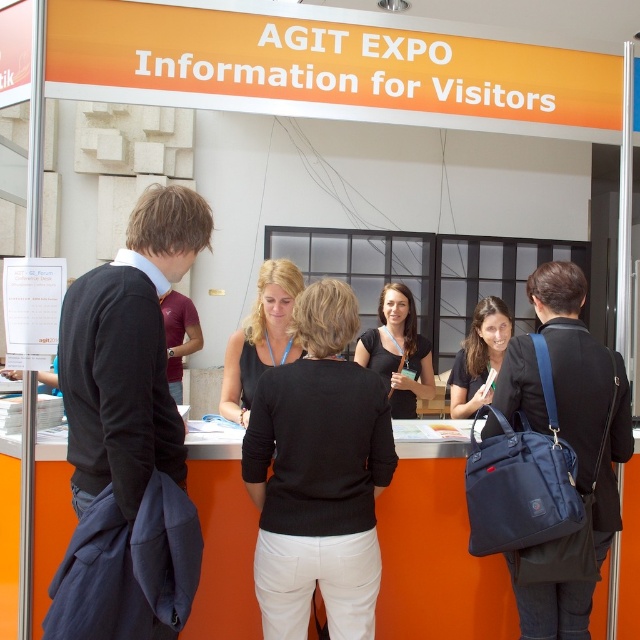
You are a visitor at the AGIT EXPO and notice two people at the information booth. One is wearing a black fabric jacket at left, and the other is wearing a maroon jersey at center. Which of these two items is positioned more to the right side of the booth?

The black fabric jacket at left is positioned more to the right side of the booth than the maroon jersey at center.